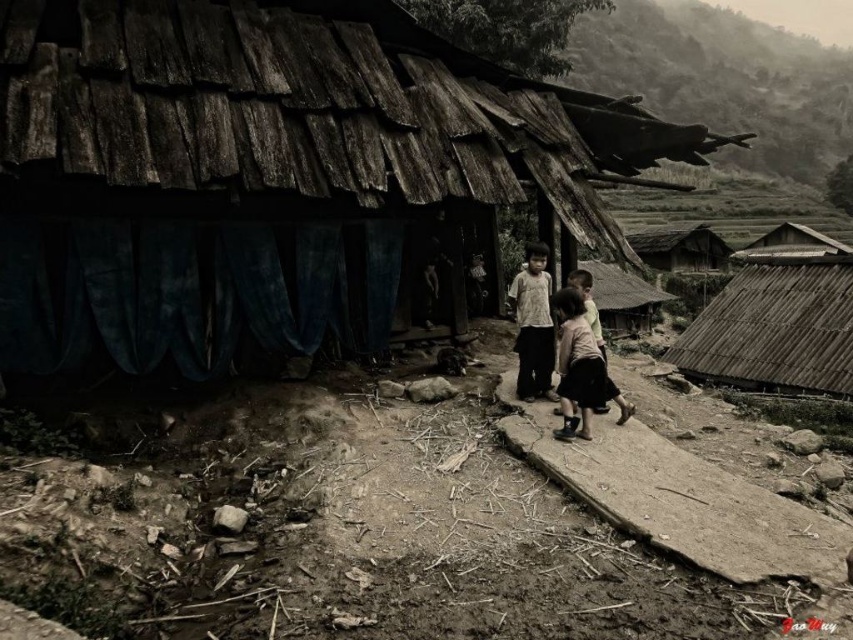
You are a traveler trying to decide between staying at the wooden thatched hut at center or the thatched roof hut at upper right. Which one has more space inside for your camping gear?

The wooden thatched hut at center might be wider than thatched roof hut at upper right, so it likely has more space inside for your camping gear.

You are a hiker who wants to take a photo of the wooden thatched hut at center and the thatched roof hut at upper right from the dirt path in front of the house. Which hut will appear higher in your photo?

The thatched roof hut at upper right will appear higher in the photo because it is located above the wooden thatched hut at center.

You are a traveler who wants to take shelter from the rain. You see the wooden shingles hut at center and the thatched roof hut at upper right. Which one is narrower and might be easier to enter quickly?

The wooden shingles hut at center is thinner than the thatched roof hut at upper right, so it might be easier to enter quickly.